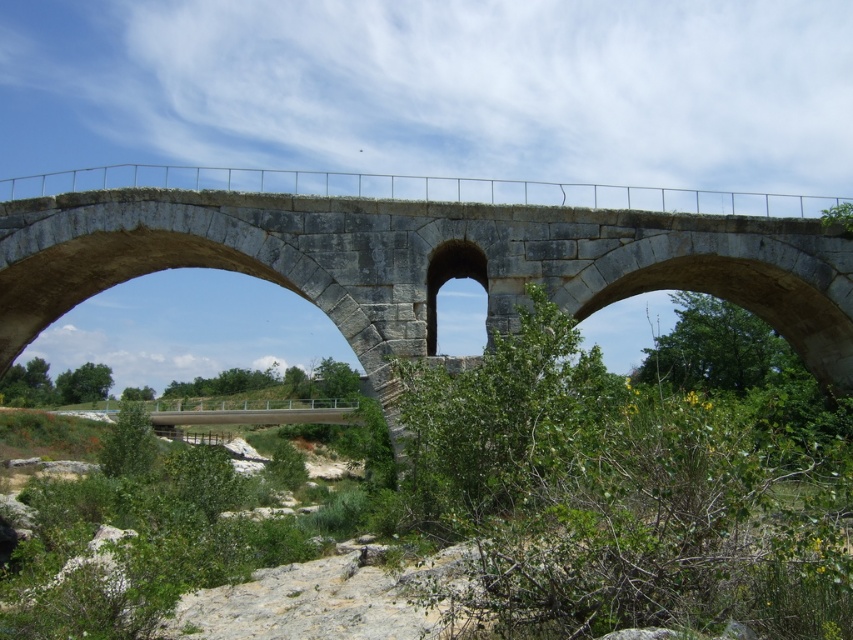
Is gray stone bridge at center wider than green leafy bush at center?

Yes, gray stone bridge at center is wider than green leafy bush at center.

Who is taller, gray stone bridge at center or green leafy bush at center?

With more height is gray stone bridge at center.

Is point (155, 179) less distant than point (419, 492)?

No, it is behind (419, 492).

The image size is (853, 640). I want to click on gray stone bridge at center, so click(x=421, y=250).

Between gray stone bridge at center and gray stone arch at center, which one has more height?

With more height is gray stone bridge at center.

Can you confirm if gray stone bridge at center is taller than gray stone arch at center?

Yes.

Identify the location of gray stone bridge at center. Image resolution: width=853 pixels, height=640 pixels. (421, 250).

Looking at this image, does green leafy bush at center have a larger size compared to gray stone arch at center?

Yes, green leafy bush at center is bigger than gray stone arch at center.

Is green leafy bush at center below gray stone arch at center?

Correct, green leafy bush at center is located below gray stone arch at center.

Who is more forward, (788, 588) or (428, 312)?

Point (788, 588) is in front.

Find the location of a particular element. The image size is (853, 640). green leafy bush at center is located at coordinates (625, 493).